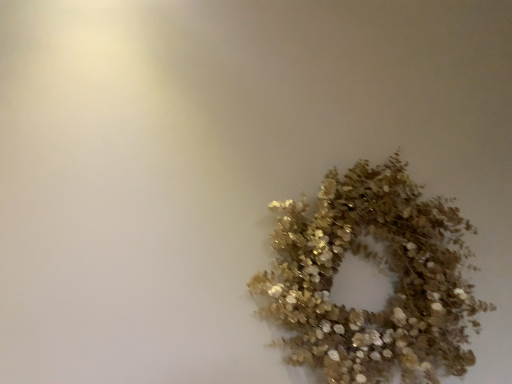
The width and height of the screenshot is (512, 384). What do you see at coordinates (378, 264) in the screenshot? I see `shiny metallic wreath at center` at bounding box center [378, 264].

At what (x,y) coordinates should I click in order to perform the action: click on shiny metallic wreath at center. Please return your answer as a coordinate pair (x, y). This screenshot has height=384, width=512. Looking at the image, I should click on (378, 264).

At what (x,y) coordinates should I click in order to perform the action: click on shiny metallic wreath at center. Please return your answer as a coordinate pair (x, y). The image size is (512, 384). Looking at the image, I should click on (378, 264).